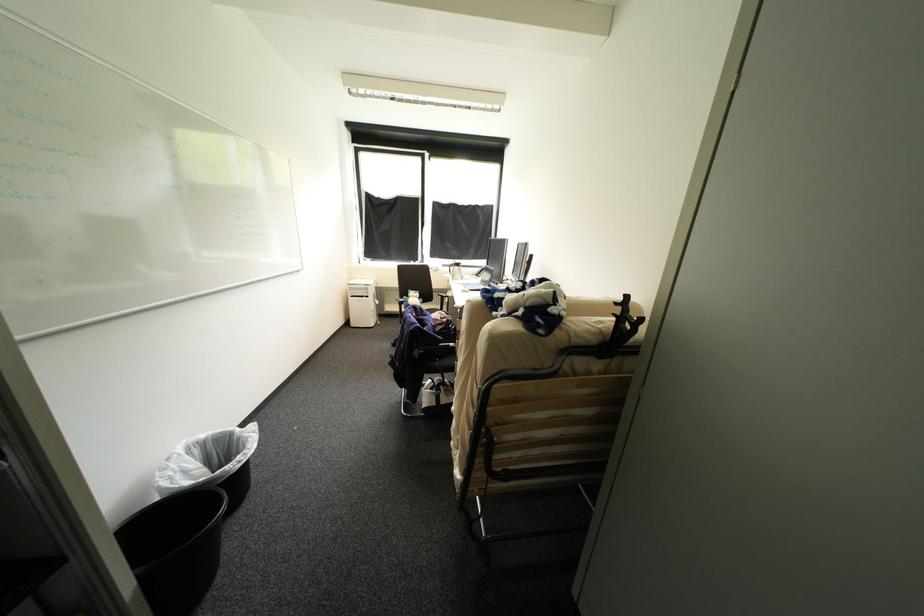
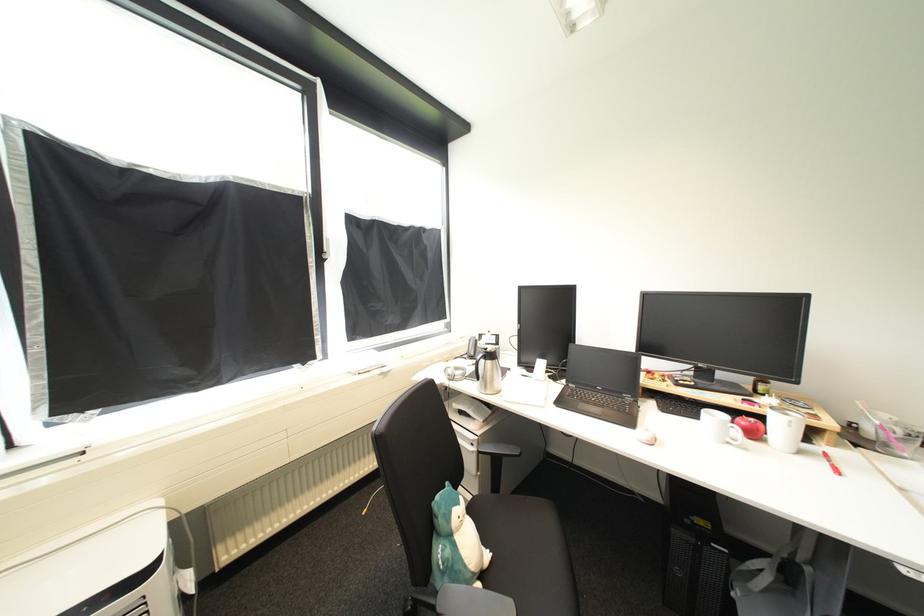
Find the pixel in the second image that matches pixel 431 222 in the first image.

(331, 257)